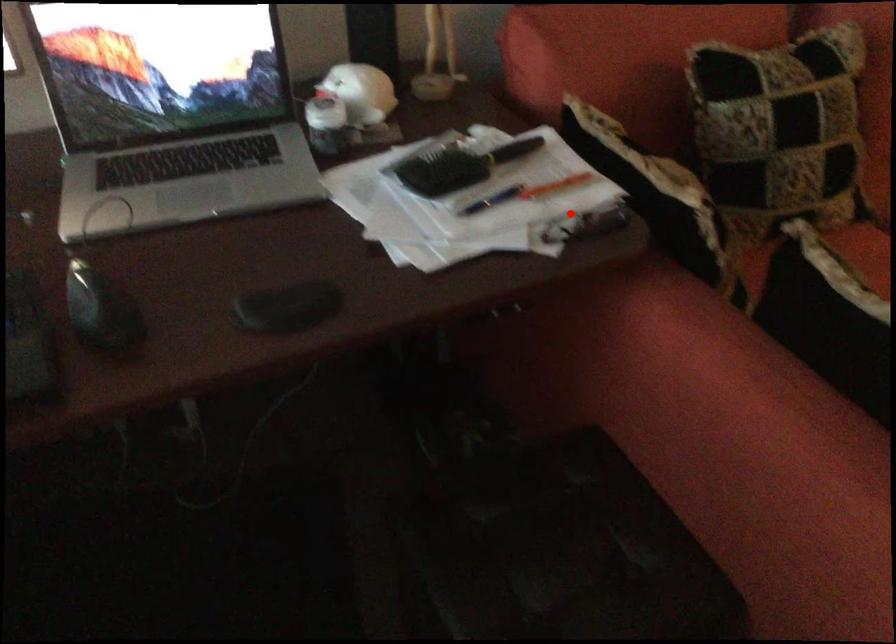
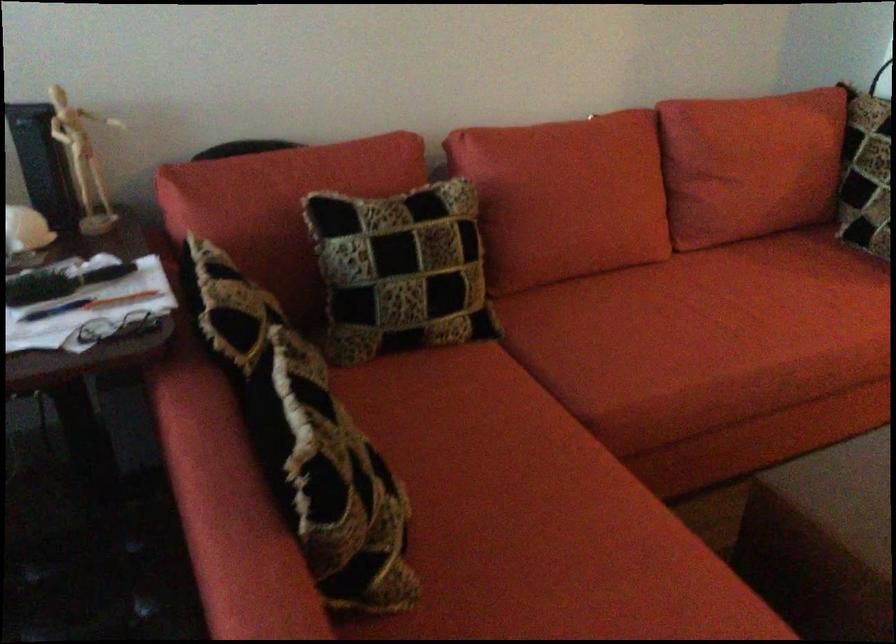
Question: I am providing you with two images of the same scene from different viewpoints. Given a red point in image1, look at the same physical point in image2. Is it:

Choices:
 (A) Closer to the viewpoint
 (B) Farther from the viewpoint

Answer: (B)